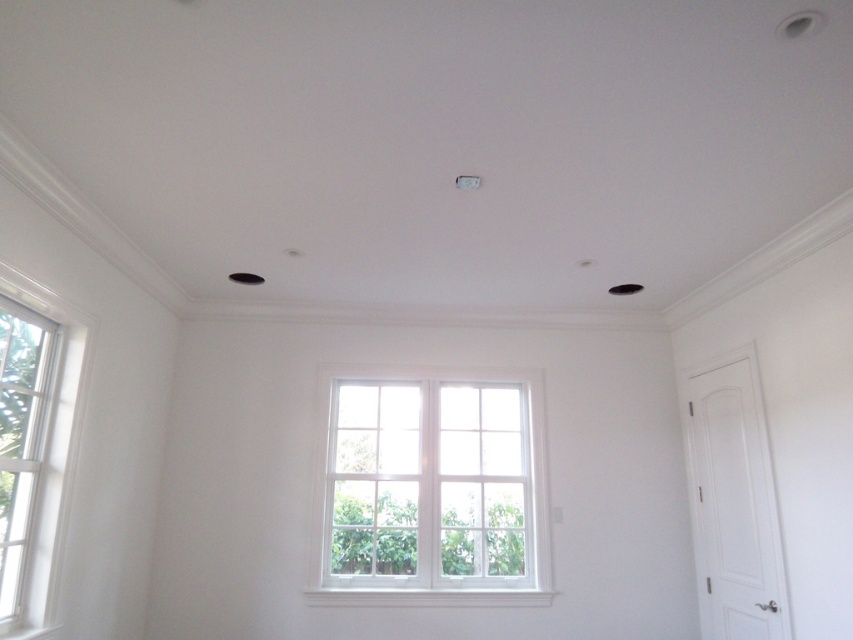
You are a window installer who needs to replace the glass panes of the white painted wood bay window at center and the white wood window at left. According to the scene description, which window is positioned lower in the room?

The white painted wood bay window at center is located below the white wood window at left, so the white painted wood bay window at center is positioned lower in the room.

You are standing in the center of the room looking towards the window. There are two points marked in the scene. Which point is closer to you, point (418, 371) or point (57, 424)?

Point (57, 424) is closer to you because point (418, 371) is behind it.

You are standing in the room depicted in the image. If you face the white painted wood bay window at center, which direction should you turn to look towards the window? Since the bay window is at the center, you don

The white painted wood bay window at center is located at coordinates point (430, 488). Since it is at the center of the image, you are already facing it, so no turn is needed.